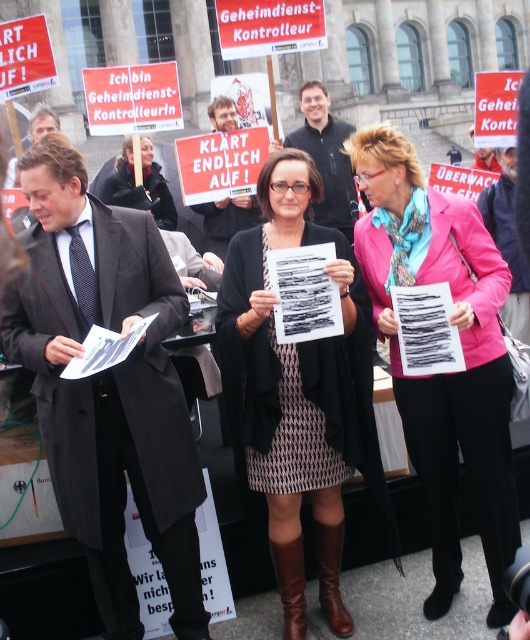
Question: Which object appears farthest from the camera in this image?

Choices:
 (A) dark gray suit at left
 (B) patterned fabric dress at center
 (C) brown leather boot at center

Answer: (B)

Question: Which object is positioned farthest from the brown leather boot at lower center?

Choices:
 (A) patterned fabric dress at center
 (B) dark gray suit at left

Answer: (B)

Question: Among these points, which one is nearest to the camera?

Choices:
 (A) (479, 433)
 (B) (322, 609)
 (C) (351, 220)
 (D) (69, 218)

Answer: (B)

Question: Is patterned fabric dress at center positioned behind matte black coat at center?

Choices:
 (A) no
 (B) yes

Answer: (A)

Question: Can you confirm if black fabric shirt at center is positioned to the right of brown leather boot at lower center?

Choices:
 (A) yes
 (B) no

Answer: (A)

Question: Where is pink fabric jacket at center located in relation to brown leather boot at center in the image?

Choices:
 (A) below
 (B) above

Answer: (B)